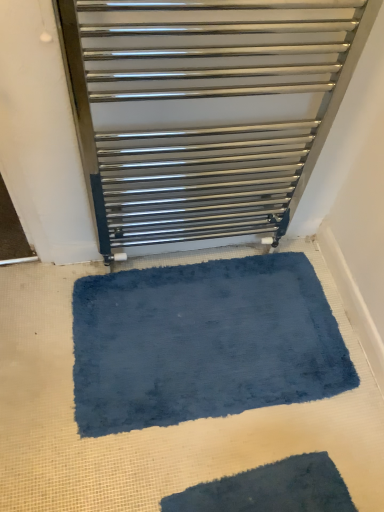
Question: Considering the relative sizes of satin silver towel rail at upper center and dark blue shaggy bath mat at lower center, marked as the first bath mat in a bottom-to-top arrangement, in the image provided, is satin silver towel rail at upper center shorter than dark blue shaggy bath mat at lower center, marked as the first bath mat in a bottom-to-top arrangement,?

Choices:
 (A) yes
 (B) no

Answer: (B)

Question: Is satin silver towel rail at upper center smaller than dark blue shaggy bath mat at lower center, positioned as the second bath mat in back-to-front order?

Choices:
 (A) no
 (B) yes

Answer: (A)

Question: Is satin silver towel rail at upper center to the right of dark blue shaggy bath mat at lower center, marked as the first bath mat in a bottom-to-top arrangement, from the viewer's perspective?

Choices:
 (A) no
 (B) yes

Answer: (A)

Question: Are satin silver towel rail at upper center and dark blue shaggy bath mat at lower center, which ranks as the first bath mat in front-to-back order, far apart?

Choices:
 (A) no
 (B) yes

Answer: (A)

Question: Considering the relative sizes of satin silver towel rail at upper center and dark blue shaggy bath mat at lower center, which appears as the second bath mat when viewed from the top, in the image provided, is satin silver towel rail at upper center taller than dark blue shaggy bath mat at lower center, which appears as the second bath mat when viewed from the top,?

Choices:
 (A) no
 (B) yes

Answer: (B)

Question: Is satin silver towel rail at upper center oriented away from dark blue shaggy bath mat at lower center, positioned as the second bath mat in back-to-front order?

Choices:
 (A) yes
 (B) no

Answer: (B)

Question: Can you confirm if satin silver towel rail at upper center is bigger than blue plush bath mat at center, arranged as the 2th bath mat when viewed from the front?

Choices:
 (A) yes
 (B) no

Answer: (A)

Question: Can blue plush bath mat at center, arranged as the 2th bath mat when viewed from the front, be found inside satin silver towel rail at upper center?

Choices:
 (A) yes
 (B) no

Answer: (B)

Question: Considering the relative sizes of satin silver towel rail at upper center and blue plush bath mat at center, arranged as the 2th bath mat when viewed from the front, in the image provided, is satin silver towel rail at upper center taller than blue plush bath mat at center, arranged as the 2th bath mat when viewed from the front,?

Choices:
 (A) yes
 (B) no

Answer: (A)

Question: Is satin silver towel rail at upper center to the left of blue plush bath mat at center, the 1th bath mat positioned from the back, from the viewer's perspective?

Choices:
 (A) yes
 (B) no

Answer: (A)

Question: Is satin silver towel rail at upper center not inside blue plush bath mat at center, the 1th bath mat positioned from the back?

Choices:
 (A) yes
 (B) no

Answer: (A)

Question: From the image's perspective, is satin silver towel rail at upper center on top of blue plush bath mat at center, the 1th bath mat positioned from the back?

Choices:
 (A) no
 (B) yes

Answer: (B)

Question: From a real-world perspective, does dark blue shaggy bath mat at lower center, which appears as the second bath mat when viewed from the top, stand above satin silver towel rail at upper center?

Choices:
 (A) no
 (B) yes

Answer: (A)